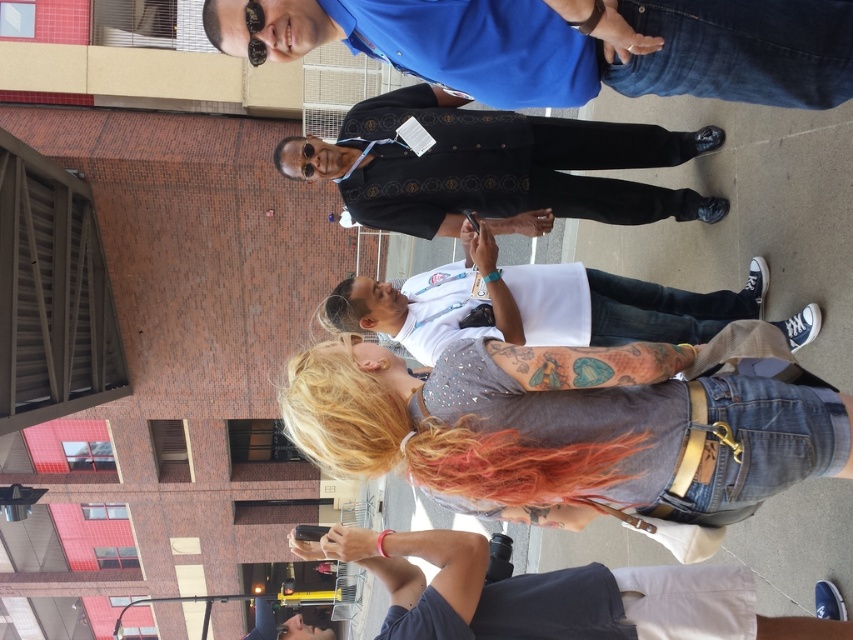
Question: Is the position of matte black shirt at center less distant than that of dark gray cotton t-shirt at lower center?

Choices:
 (A) no
 (B) yes

Answer: (A)

Question: Can you confirm if gray t-shirt at center is thinner than dark gray cotton t-shirt at lower center?

Choices:
 (A) yes
 (B) no

Answer: (B)

Question: Which of the following is the farthest from the observer?

Choices:
 (A) (643, 208)
 (B) (764, 77)
 (C) (512, 627)

Answer: (A)

Question: Which of the following is the farthest from the observer?

Choices:
 (A) dark gray cotton t-shirt at lower center
 (B) matte black shirt at center
 (C) blue shirt at upper center

Answer: (B)

Question: Is matte black shirt at center closer to camera compared to dark gray cotton t-shirt at lower center?

Choices:
 (A) no
 (B) yes

Answer: (A)

Question: Which point is farther from the camera taking this photo?

Choices:
 (A) (677, 400)
 (B) (669, 74)
 (C) (451, 548)
 (D) (520, 301)

Answer: (D)